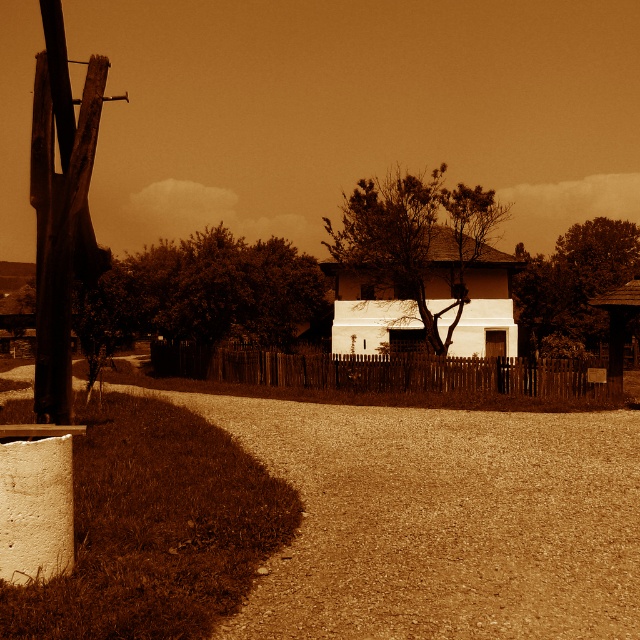
Question: Which point is closer to the camera taking this photo?

Choices:
 (A) (362, 436)
 (B) (554, 278)
 (C) (282, 298)
 (D) (412, 189)

Answer: (A)

Question: Is smooth white tree at center to the right of smooth bark tree at center from the viewer's perspective?

Choices:
 (A) no
 (B) yes

Answer: (A)

Question: Which object is the farthest from the smooth white tree at center?

Choices:
 (A) dirt gravel at lower center
 (B) smooth bark tree at center
 (C) thick textured tree at center

Answer: (A)

Question: Can you confirm if smooth white tree at center is smaller than smooth bark tree at center?

Choices:
 (A) no
 (B) yes

Answer: (A)

Question: Can you confirm if smooth white tree at center is positioned below smooth bark tree at center?

Choices:
 (A) yes
 (B) no

Answer: (B)

Question: Which object is the farthest from the smooth bark tree at center?

Choices:
 (A) dirt gravel at lower center
 (B) thick textured tree at center
 (C) smooth white tree at center

Answer: (B)